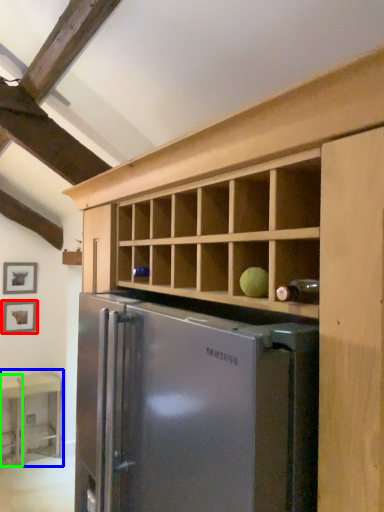
Question: Estimate the real-world distances between objects in this image. Which object is farther from picture frame (highlighted by a red box), table (highlighted by a blue box) or table (highlighted by a green box)?

Choices:
 (A) table
 (B) table

Answer: (A)